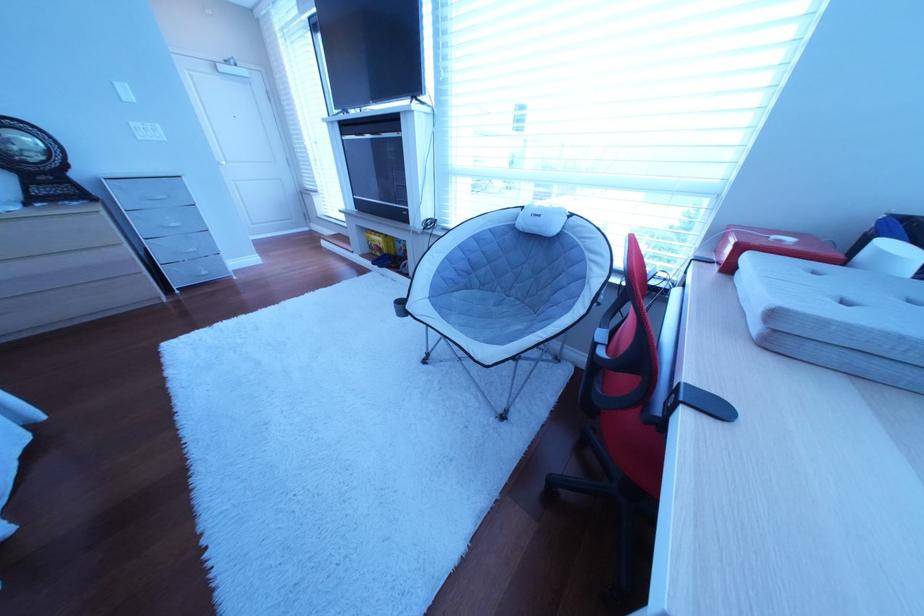
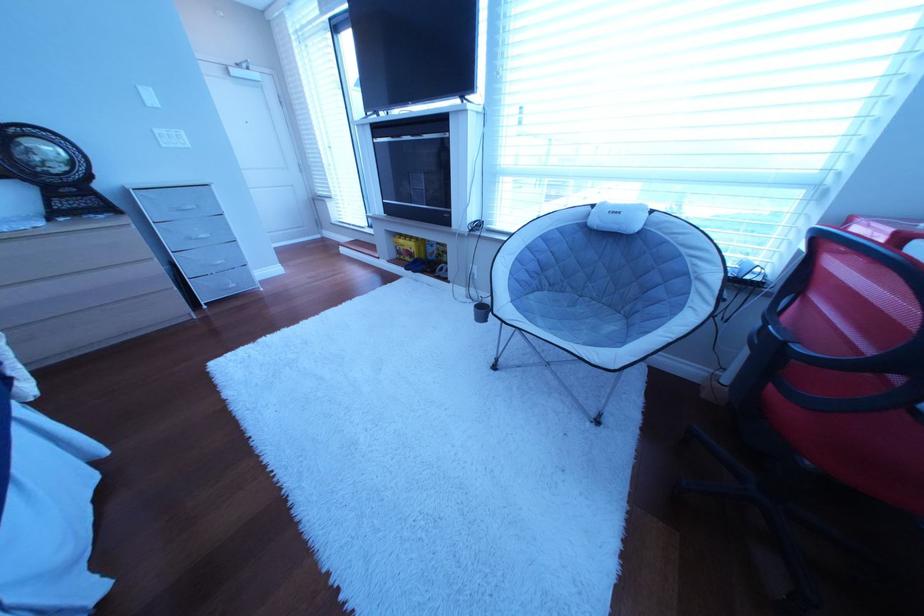
Question: Based on the continuous images, in which direction is the camera rotating? Reply with the corresponding letter.

Choices:
 (A) Left
 (B) Right
 (C) Up
 (D) Down

Answer: (B)